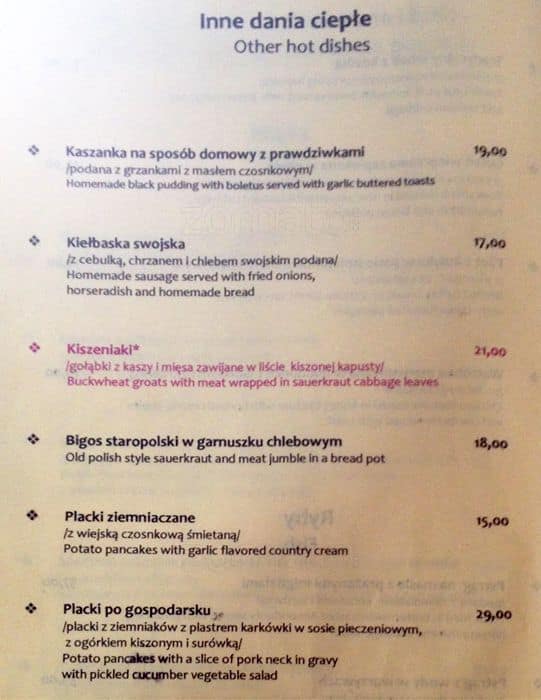
I want to click on pot, so click(388, 466).